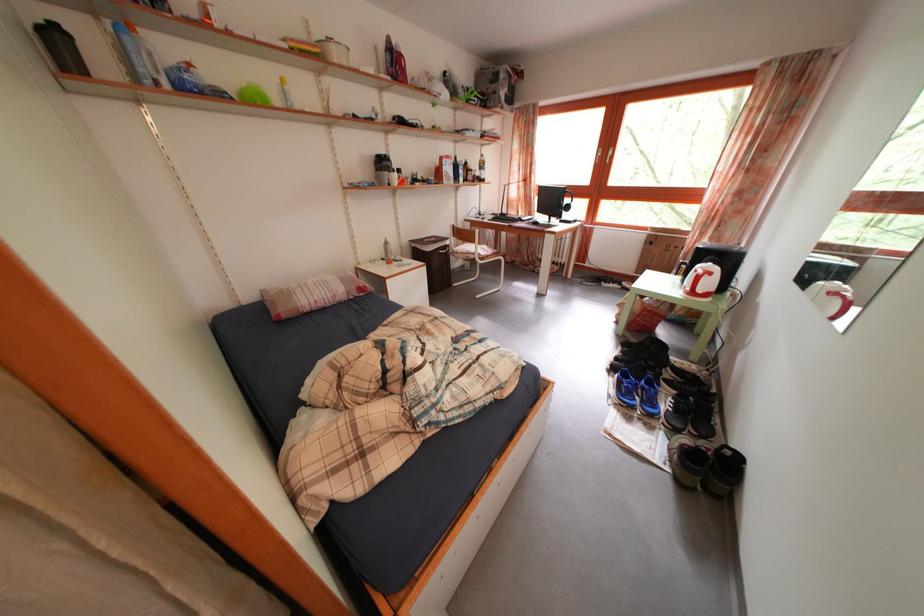
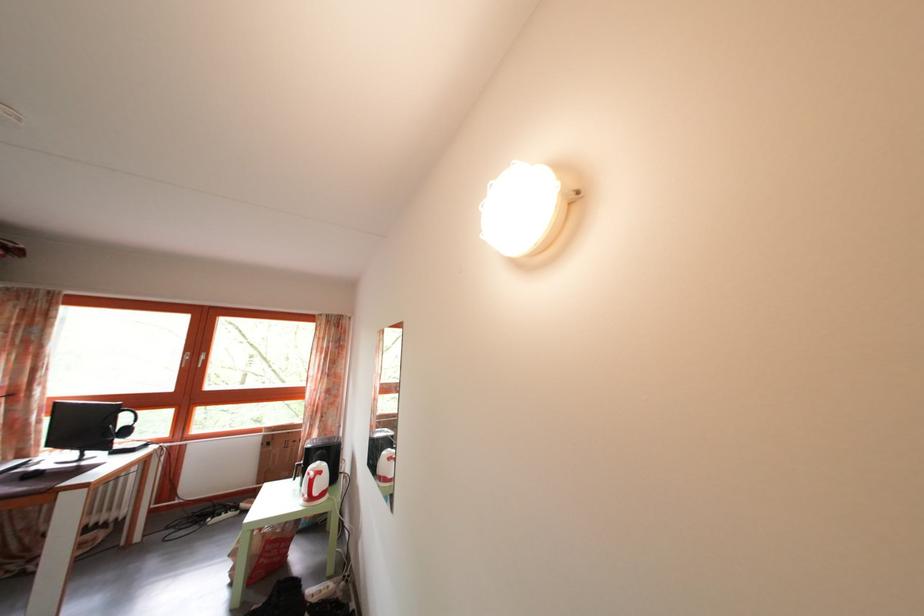
First-person continuous shooting, in which direction is the camera rotating?

The camera's rotation is toward right-up.